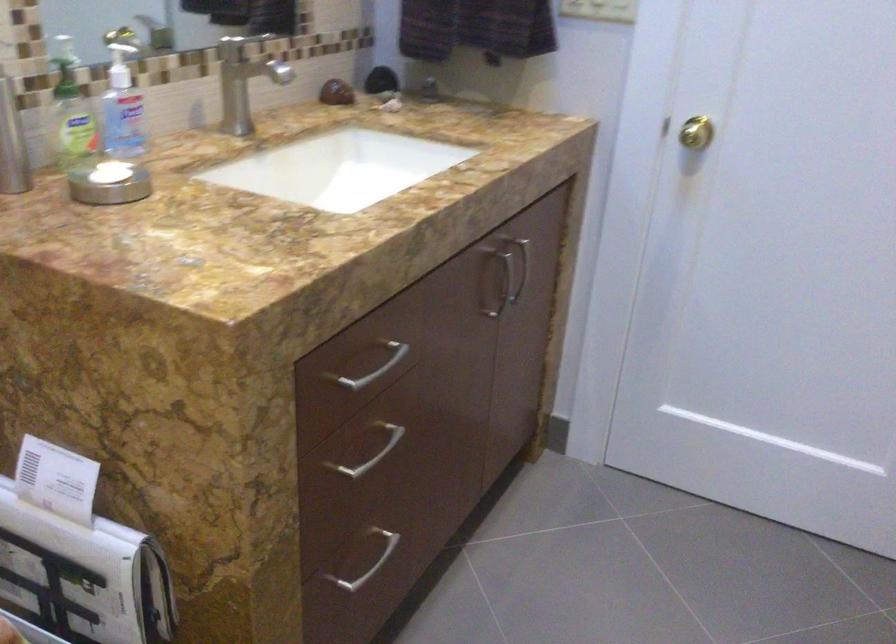
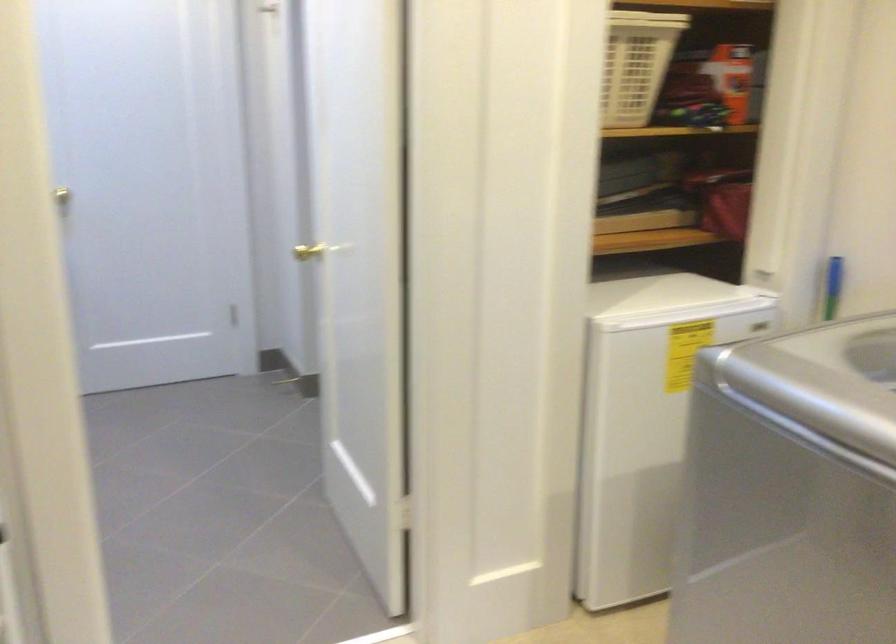
The point at (681, 134) is marked in the first image. Where is the corresponding point in the second image?

(71, 192)